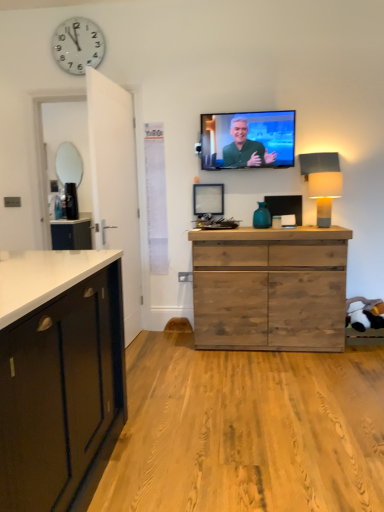
Question: Can we say matte green screen at upper center lies outside matte gray lampshade at right?

Choices:
 (A) yes
 (B) no

Answer: (A)

Question: Is matte green screen at upper center to the right of matte gray lampshade at right from the viewer's perspective?

Choices:
 (A) yes
 (B) no

Answer: (B)

Question: Considering the relative positions of matte green screen at upper center and matte gray lampshade at right in the image provided, is matte green screen at upper center to the left of matte gray lampshade at right from the viewer's perspective?

Choices:
 (A) yes
 (B) no

Answer: (A)

Question: Would you say matte gray lampshade at right is part of matte green screen at upper center's contents?

Choices:
 (A) yes
 (B) no

Answer: (B)

Question: Considering the relative sizes of matte green screen at upper center and matte gray lampshade at right in the image provided, is matte green screen at upper center bigger than matte gray lampshade at right?

Choices:
 (A) no
 (B) yes

Answer: (B)

Question: In the image, is white plastic clock at upper left positioned in front of or behind wooden picture frame at center?

Choices:
 (A) front
 (B) behind

Answer: (A)

Question: Is point [x=86, y=37] closer or farther from the camera than point [x=216, y=209]?

Choices:
 (A) closer
 (B) farther

Answer: (A)

Question: From a real-world perspective, relative to wooden picture frame at center, is white plastic clock at upper left vertically above or below?

Choices:
 (A) above
 (B) below

Answer: (A)

Question: Considering the positions of white plastic clock at upper left and wooden picture frame at center in the image, is white plastic clock at upper left taller or shorter than wooden picture frame at center?

Choices:
 (A) tall
 (B) short

Answer: (A)

Question: From the image's perspective, is matte green screen at upper center located above or below black glossy coffee maker at left?

Choices:
 (A) above
 (B) below

Answer: (A)

Question: Choose the correct answer: Is matte green screen at upper center inside black glossy coffee maker at left or outside it?

Choices:
 (A) outside
 (B) inside

Answer: (A)

Question: Relative to black glossy coffee maker at left, is matte green screen at upper center in front or behind?

Choices:
 (A) front
 (B) behind

Answer: (A)

Question: Is matte green screen at upper center wider or thinner than black glossy coffee maker at left?

Choices:
 (A) thin
 (B) wide

Answer: (A)

Question: Is matte silver mirror at left situated inside matte green screen at upper center or outside?

Choices:
 (A) inside
 (B) outside

Answer: (B)

Question: From a real-world perspective, relative to matte green screen at upper center, is matte silver mirror at left vertically above or below?

Choices:
 (A) above
 (B) below

Answer: (B)